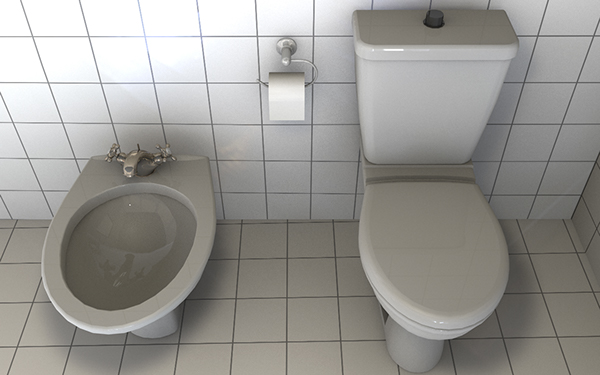
I want to click on toilet tank, so [446, 43].